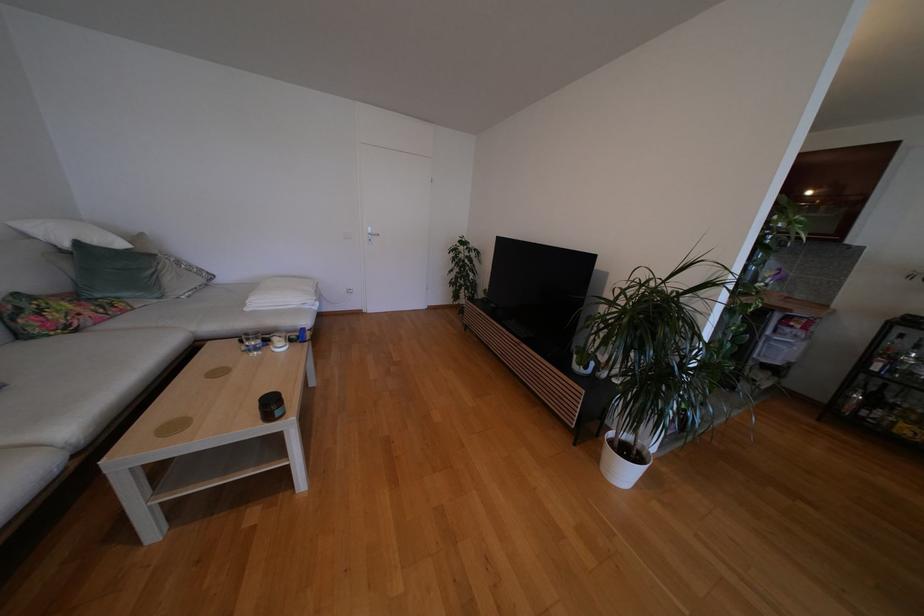
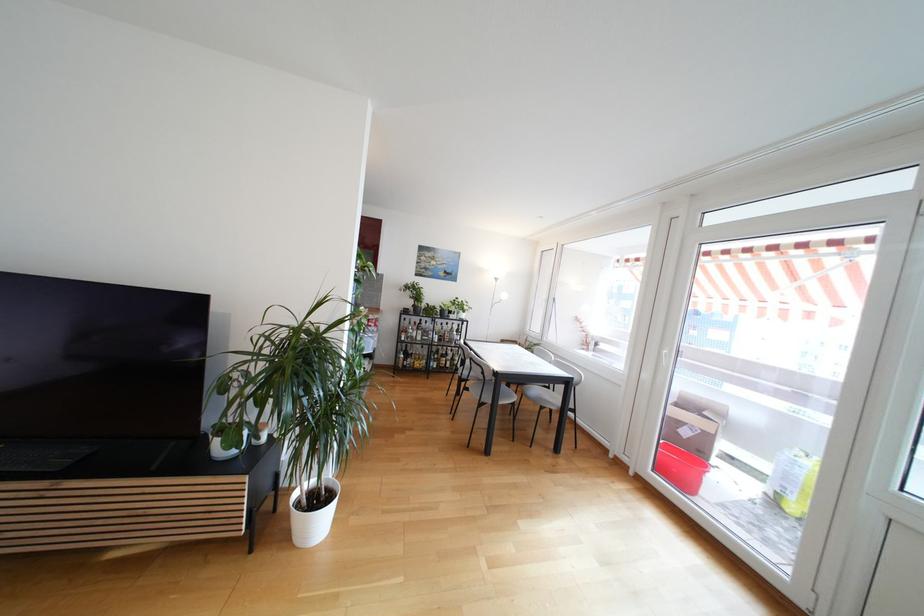
Locate, in the second image, the point that corresponds to (x=892, y=325) in the first image.

(405, 315)